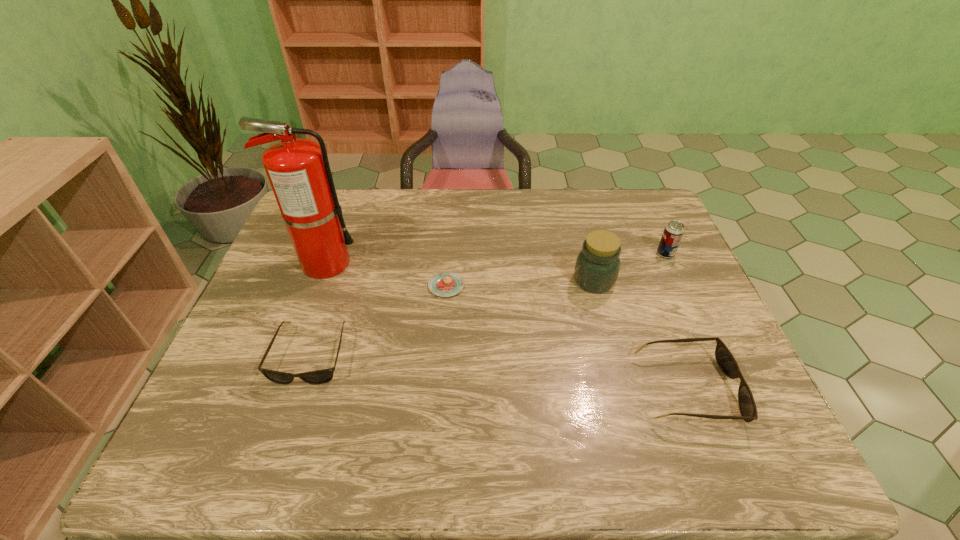
Find the location of a particular element. free spot located on the left of the fourth object from right to left is located at coordinates (396, 286).

Identify the location of free space located 0.190m at the nozzle of the tallest object. The width and height of the screenshot is (960, 540). (423, 263).

Locate an element on the screen. Image resolution: width=960 pixels, height=540 pixels. vacant space positioned 0.200m on the right of the fifth shortest object is located at coordinates (685, 281).

I want to click on sunglasses that is at the left edge, so click(x=323, y=376).

Image resolution: width=960 pixels, height=540 pixels. Identify the location of fire extinguisher that is at the left edge. (298, 170).

Where is `sunglasses present at the right edge`? The height and width of the screenshot is (540, 960). sunglasses present at the right edge is located at coordinates (724, 358).

Image resolution: width=960 pixels, height=540 pixels. Identify the location of beer can that is at the right edge. (673, 232).

Locate an element on the screen. This screenshot has width=960, height=540. object that is at the near left corner is located at coordinates [x=323, y=376].

Locate an element on the screen. Image resolution: width=960 pixels, height=540 pixels. object present at the near right corner is located at coordinates (724, 358).

Where is `blank area at the far edge`? This screenshot has height=540, width=960. blank area at the far edge is located at coordinates (536, 195).